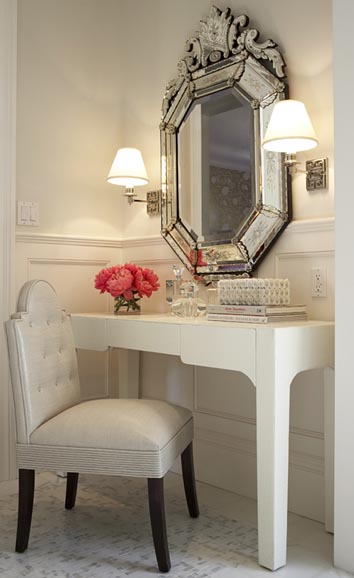
The height and width of the screenshot is (578, 354). What are the coordinates of `perfume` in the screenshot? It's located at (185, 296).